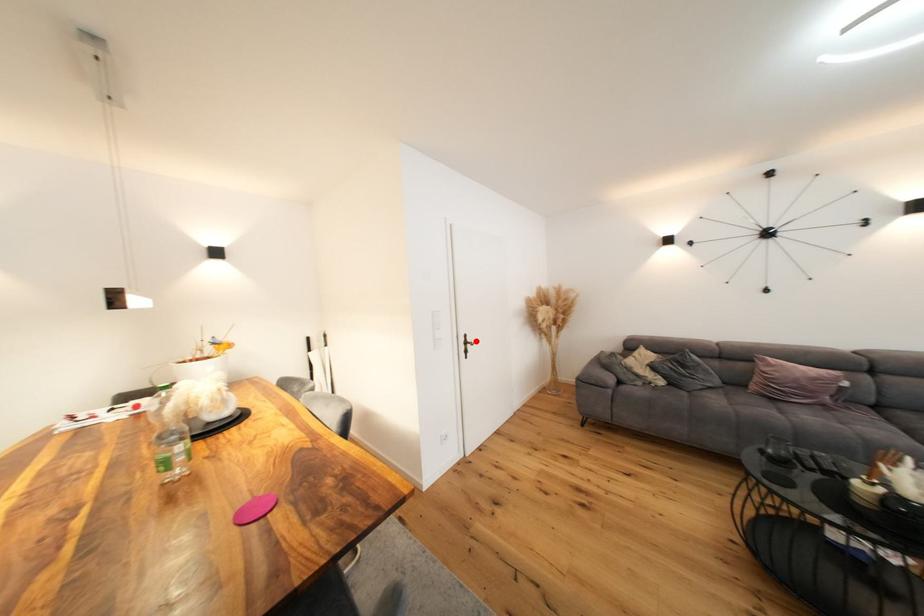
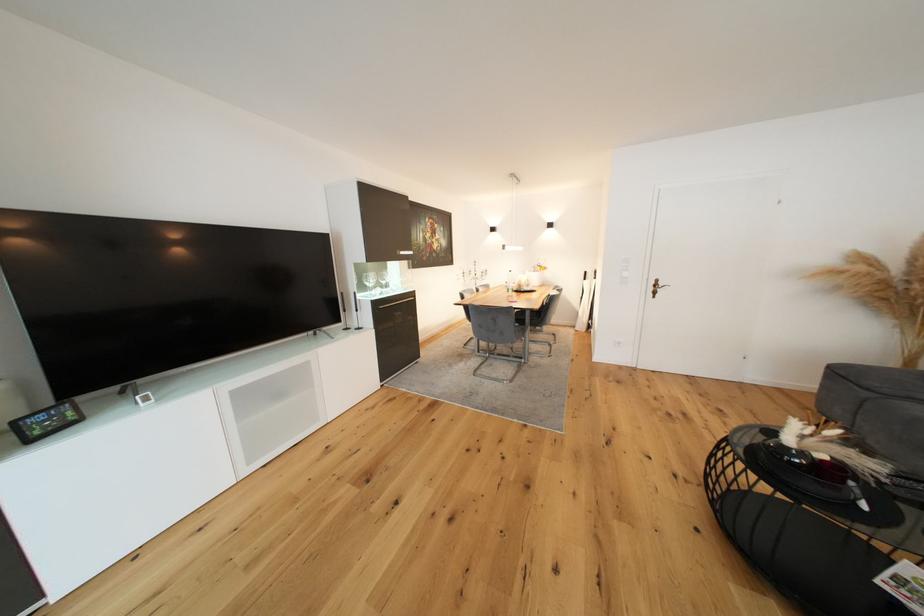
Where in the second image is the point corresponding to the highlighted location from the first image?

(667, 286)